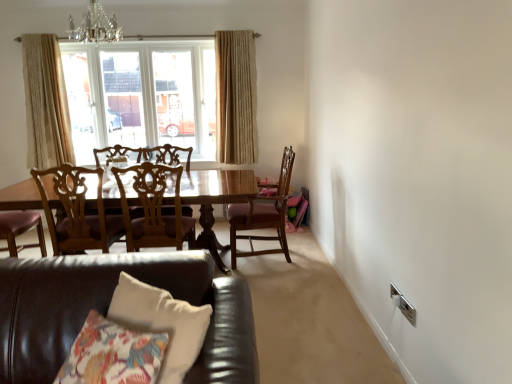
Question: Can you confirm if beige textured curtain at left, positioned as the second curtain in right-to-left order, is smaller than wooden chair at center, which appears as the 3th chair when viewed from the left?

Choices:
 (A) no
 (B) yes

Answer: (B)

Question: Considering the relative positions of beige textured curtain at left, positioned as the second curtain in right-to-left order, and wooden chair at center, marked as the first chair in a right-to-left arrangement, in the image provided, is beige textured curtain at left, positioned as the second curtain in right-to-left order, to the left of wooden chair at center, marked as the first chair in a right-to-left arrangement, from the viewer's perspective?

Choices:
 (A) no
 (B) yes

Answer: (B)

Question: Can you confirm if beige textured curtain at left, positioned as the second curtain in right-to-left order, is bigger than wooden chair at center, which appears as the 3th chair when viewed from the left?

Choices:
 (A) yes
 (B) no

Answer: (B)

Question: Is beige textured curtain at left, arranged as the 1th curtain when viewed from the left, next to wooden chair at center, marked as the first chair in a right-to-left arrangement, and touching it?

Choices:
 (A) no
 (B) yes

Answer: (A)

Question: Is beige textured curtain at left, positioned as the second curtain in right-to-left order, looking in the opposite direction of wooden chair at center, which appears as the 3th chair when viewed from the left?

Choices:
 (A) no
 (B) yes

Answer: (A)

Question: From a real-world perspective, is beige textured curtain at left, positioned as the second curtain in right-to-left order, on wooden chair at center, which appears as the 3th chair when viewed from the left?

Choices:
 (A) yes
 (B) no

Answer: (A)

Question: Considering the relative sizes of clear glass window at upper center and beige textured curtain at left, positioned as the second curtain in right-to-left order, in the image provided, is clear glass window at upper center bigger than beige textured curtain at left, positioned as the second curtain in right-to-left order,?

Choices:
 (A) yes
 (B) no

Answer: (A)

Question: Are clear glass window at upper center and beige textured curtain at left, arranged as the 1th curtain when viewed from the left, beside each other?

Choices:
 (A) no
 (B) yes

Answer: (A)

Question: Can you confirm if clear glass window at upper center is taller than beige textured curtain at left, positioned as the second curtain in right-to-left order?

Choices:
 (A) no
 (B) yes

Answer: (A)

Question: Can you confirm if clear glass window at upper center is wider than beige textured curtain at left, positioned as the second curtain in right-to-left order?

Choices:
 (A) no
 (B) yes

Answer: (B)

Question: Is clear glass window at upper center located outside beige textured curtain at left, positioned as the second curtain in right-to-left order?

Choices:
 (A) no
 (B) yes

Answer: (B)

Question: Is clear glass window at upper center at the right side of beige textured curtain at left, positioned as the second curtain in right-to-left order?

Choices:
 (A) yes
 (B) no

Answer: (A)

Question: From a real-world perspective, is wooden chair with carved backrest at center, which appears as the third chair when viewed from the right, under crystal glass chandelier at upper center?

Choices:
 (A) no
 (B) yes

Answer: (B)